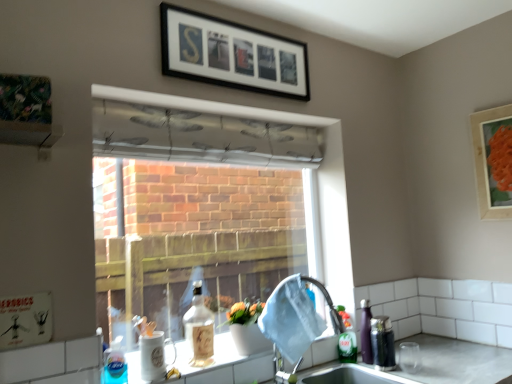
Question: From a real-world perspective, is matte wooden picture frame at upper right, marked as the 1th picture frame in a right-to-left arrangement, over translucent plastic bottle at lower left, the third bottle in the back-to-front sequence?

Choices:
 (A) no
 (B) yes

Answer: (B)

Question: From a real-world perspective, is matte wooden picture frame at upper right, which is counted as the second picture frame, starting from the left, below translucent plastic bottle at lower left, placed as the first bottle when sorted from front to back?

Choices:
 (A) no
 (B) yes

Answer: (A)

Question: Is matte wooden picture frame at upper right, marked as the 1th picture frame in a right-to-left arrangement, facing towards translucent plastic bottle at lower left, acting as the first bottle starting from the left?

Choices:
 (A) no
 (B) yes

Answer: (A)

Question: Is matte wooden picture frame at upper right, marked as the 1th picture frame in a right-to-left arrangement, closer to camera compared to translucent plastic bottle at lower left, acting as the first bottle starting from the left?

Choices:
 (A) no
 (B) yes

Answer: (A)

Question: Is matte wooden picture frame at upper right, which is counted as the first picture frame, starting from the bottom, positioned with its back to translucent plastic bottle at lower left, which ranks as the third bottle in right-to-left order?

Choices:
 (A) yes
 (B) no

Answer: (B)

Question: Does point (298, 44) appear closer or farther from the camera than point (119, 370)?

Choices:
 (A) farther
 (B) closer

Answer: (A)

Question: Considering their positions, is black matte picture frame at upper center, the second picture frame in the bottom-to-top sequence, located in front of or behind translucent plastic bottle at lower left, placed as the first bottle when sorted from front to back?

Choices:
 (A) front
 (B) behind

Answer: (B)

Question: Would you say black matte picture frame at upper center, which ranks as the first picture frame in left-to-right order, is inside or outside translucent plastic bottle at lower left, acting as the first bottle starting from the left?

Choices:
 (A) inside
 (B) outside

Answer: (B)

Question: In the image, is black matte picture frame at upper center, the 2th picture frame from the right, on the left side or the right side of translucent plastic bottle at lower left, the third bottle in the back-to-front sequence?

Choices:
 (A) left
 (B) right

Answer: (B)

Question: In terms of width, does translucent plastic bottle at lower left, acting as the first bottle starting from the left, look wider or thinner when compared to transparent fabric at center?

Choices:
 (A) wide
 (B) thin

Answer: (B)

Question: Considering the relative positions of translucent plastic bottle at lower left, acting as the first bottle starting from the left, and transparent fabric at center in the image provided, is translucent plastic bottle at lower left, acting as the first bottle starting from the left, to the left or to the right of transparent fabric at center?

Choices:
 (A) left
 (B) right

Answer: (A)

Question: From their relative heights in the image, would you say translucent plastic bottle at lower left, which ranks as the third bottle in right-to-left order, is taller or shorter than transparent fabric at center?

Choices:
 (A) tall
 (B) short

Answer: (B)

Question: Do you think translucent plastic bottle at lower left, placed as the first bottle when sorted from front to back, is within transparent fabric at center, or outside of it?

Choices:
 (A) inside
 (B) outside

Answer: (B)

Question: Is matte wooden picture frame at upper right, which is counted as the second picture frame, starting from the left, taller or shorter than white ceramic mug at lower center?

Choices:
 (A) short
 (B) tall

Answer: (B)

Question: Is matte wooden picture frame at upper right, which is counted as the first picture frame, starting from the bottom, spatially inside white ceramic mug at lower center, or outside of it?

Choices:
 (A) outside
 (B) inside

Answer: (A)